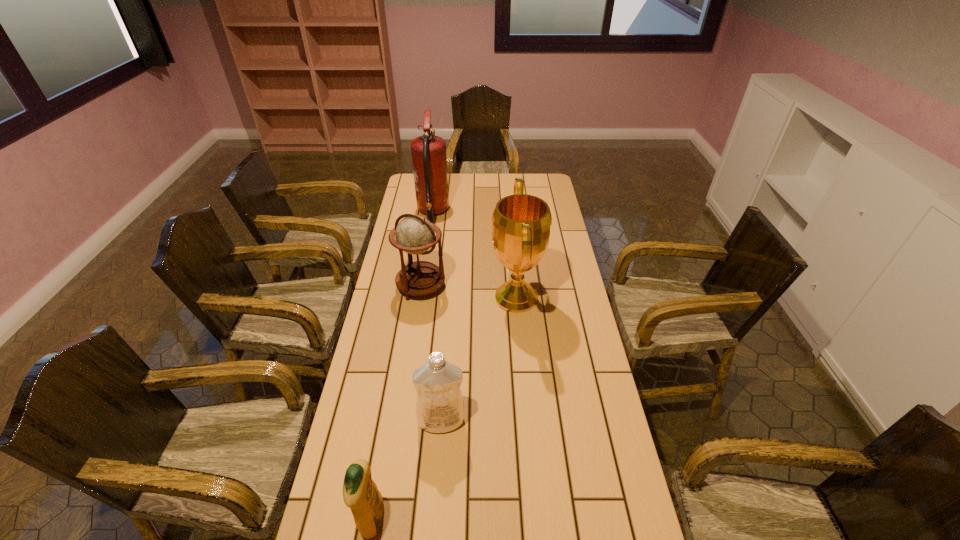
I want to click on vacant space situated on the back of the right detergent, so click(x=449, y=313).

This screenshot has width=960, height=540. In order to click on fire extinguisher that is at the left edge in this screenshot , I will do `click(429, 160)`.

At what (x,y) coordinates should I click in order to perform the action: click on globe at the left edge. Please return your answer as a coordinate pair (x, y). Looking at the image, I should click on (414, 234).

Image resolution: width=960 pixels, height=540 pixels. I want to click on object that is at the right edge, so click(521, 223).

Locate an element on the screen. The image size is (960, 540). free space at the left edge of the desktop is located at coordinates (350, 535).

Locate an element on the screen. vacant space at the right edge of the desktop is located at coordinates (544, 263).

Where is `vacant space at the far left corner of the desktop`? The image size is (960, 540). vacant space at the far left corner of the desktop is located at coordinates (410, 187).

This screenshot has height=540, width=960. Find the location of `vacant region between the fire extinguisher and the farther detergent`. vacant region between the fire extinguisher and the farther detergent is located at coordinates 437,316.

This screenshot has width=960, height=540. I want to click on empty space that is in between the fourth farthest object and the farthest object, so click(437, 316).

Find the location of a particular element. The width and height of the screenshot is (960, 540). free spot between the right detergent and the farthest object is located at coordinates (437, 316).